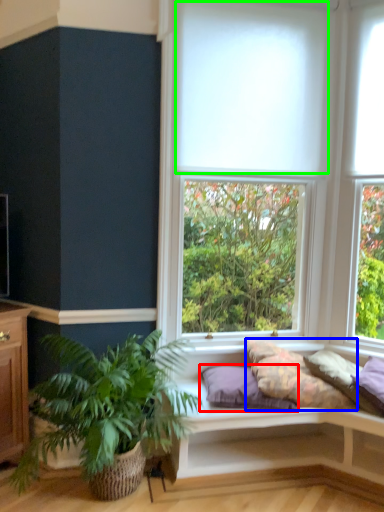
Question: Which is nearer to the pillow (highlighted by a red box)? pillow (highlighted by a blue box) or blind (highlighted by a green box).

Choices:
 (A) pillow
 (B) blind

Answer: (A)